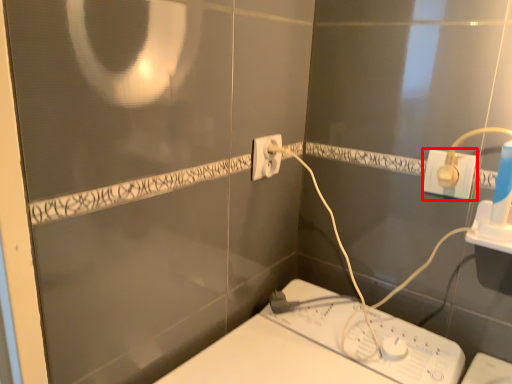
Question: In this image, where is power plugs and sockets (annotated by the red box) located relative to power plugs and sockets?

Choices:
 (A) right
 (B) left

Answer: (A)